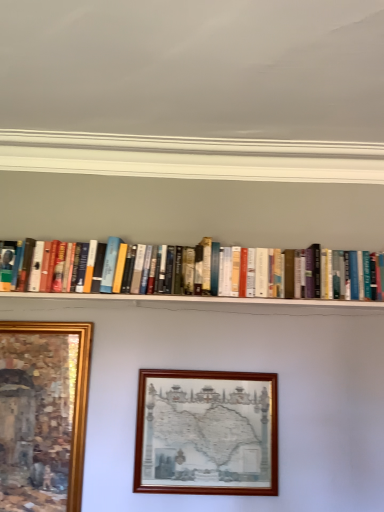
Question: Is hardcover books at center behind wooden picture frame at center, which is the second picture frame in left-to-right order?

Choices:
 (A) no
 (B) yes

Answer: (B)

Question: Considering the relative sizes of hardcover books at center and wooden picture frame at center, placed as the 1th picture frame when sorted from right to left, in the image provided, is hardcover books at center taller than wooden picture frame at center, placed as the 1th picture frame when sorted from right to left,?

Choices:
 (A) no
 (B) yes

Answer: (A)

Question: Considering the relative sizes of hardcover books at center and wooden picture frame at center, placed as the 1th picture frame when sorted from right to left, in the image provided, is hardcover books at center bigger than wooden picture frame at center, placed as the 1th picture frame when sorted from right to left,?

Choices:
 (A) no
 (B) yes

Answer: (B)

Question: From a real-world perspective, is hardcover books at center beneath wooden picture frame at center, placed as the 1th picture frame when sorted from right to left?

Choices:
 (A) no
 (B) yes

Answer: (A)

Question: From the image's perspective, does hardcover books at center appear lower than wooden picture frame at center, placed as the 1th picture frame when sorted from right to left?

Choices:
 (A) no
 (B) yes

Answer: (A)

Question: Does hardcover books at center have a lesser width compared to wooden picture frame at center, which is the second picture frame in left-to-right order?

Choices:
 (A) no
 (B) yes

Answer: (A)

Question: Is gold-framed painting at lower left, which is the 1th picture frame in left-to-right order, completely or partially inside wooden picture frame at center, which is the second picture frame in left-to-right order?

Choices:
 (A) no
 (B) yes

Answer: (A)

Question: Is wooden picture frame at center, which is the second picture frame in left-to-right order, smaller than gold-framed painting at lower left, which is the 1th picture frame in left-to-right order?

Choices:
 (A) yes
 (B) no

Answer: (A)

Question: Is wooden picture frame at center, placed as the 1th picture frame when sorted from right to left, next to gold-framed painting at lower left, the 2th picture frame viewed from the right, and touching it?

Choices:
 (A) no
 (B) yes

Answer: (A)

Question: Can you confirm if wooden picture frame at center, placed as the 1th picture frame when sorted from right to left, is wider than gold-framed painting at lower left, the 2th picture frame viewed from the right?

Choices:
 (A) no
 (B) yes

Answer: (A)

Question: Would you consider wooden picture frame at center, placed as the 1th picture frame when sorted from right to left, to be distant from gold-framed painting at lower left, which is the 1th picture frame in left-to-right order?

Choices:
 (A) no
 (B) yes

Answer: (A)

Question: Considering the relative positions of wooden picture frame at center, placed as the 1th picture frame when sorted from right to left, and gold-framed painting at lower left, the 2th picture frame viewed from the right, in the image provided, is wooden picture frame at center, placed as the 1th picture frame when sorted from right to left, to the right of gold-framed painting at lower left, the 2th picture frame viewed from the right, from the viewer's perspective?

Choices:
 (A) yes
 (B) no

Answer: (A)

Question: Is hardcover books at center looking in the opposite direction of gold-framed painting at lower left, the 2th picture frame viewed from the right?

Choices:
 (A) yes
 (B) no

Answer: (B)